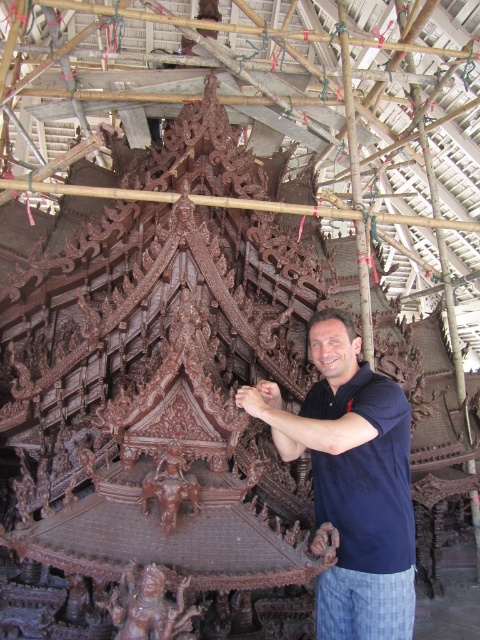
Question: Does dark brown wood at left have a lesser width compared to brown carved elephant at center?

Choices:
 (A) no
 (B) yes

Answer: (B)

Question: Is dark brown wood at left closer to camera compared to brown carved statue at lower center?

Choices:
 (A) yes
 (B) no

Answer: (B)

Question: Which object is farther from the camera taking this photo?

Choices:
 (A) brown carved statue at lower center
 (B) dark brown wood at left
 (C) brown carved elephant at center

Answer: (C)

Question: Can you confirm if brown carved statue at lower center is wider than brown carved elephant at center?

Choices:
 (A) no
 (B) yes

Answer: (B)

Question: Which of the following is the closest to the observer?

Choices:
 (A) (180, 461)
 (B) (348, 592)
 (C) (163, 609)

Answer: (C)

Question: Which point is closer to the camera?

Choices:
 (A) dark brown wood at left
 (B) brown carved elephant at center
 (C) brown carved statue at lower center

Answer: (C)